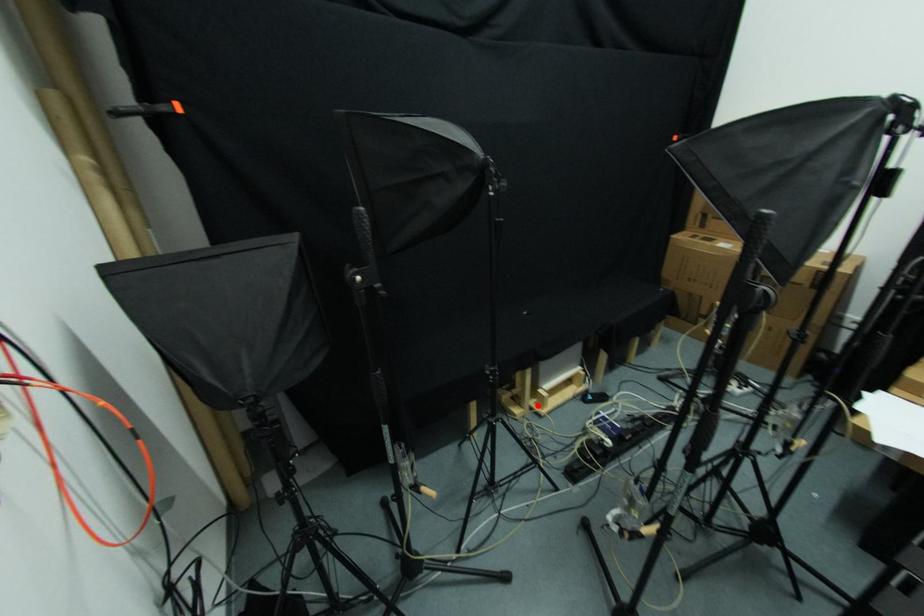
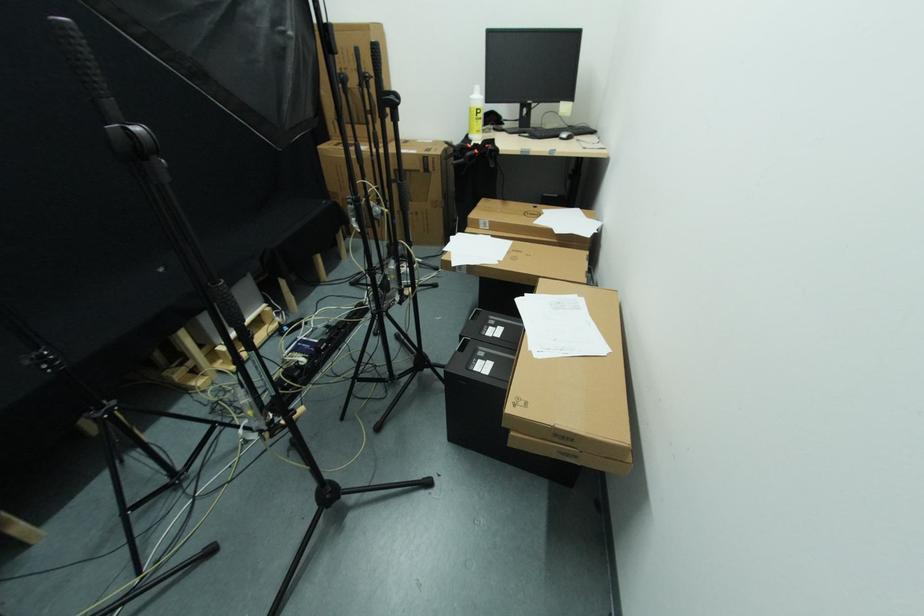
Question: A red point is marked in image1. In image2, is the corresponding 3D point closer to the camera or farther? Reply with the corresponding letter.

Choices:
 (A) The corresponding 3D point is closer.
 (B) The corresponding 3D point is farther.

Answer: (A)